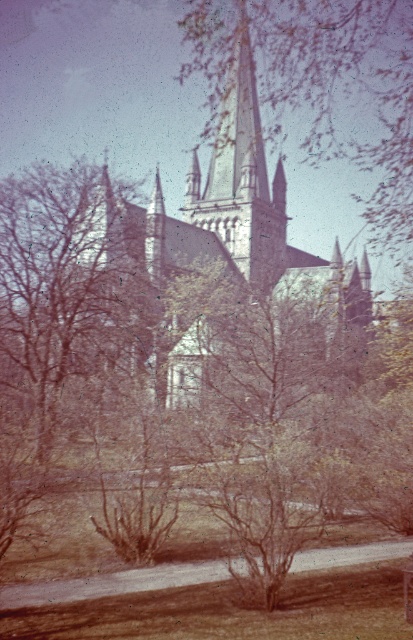
Question: Which object appears closest to the camera in this image?

Choices:
 (A) smooth gray steeple at center
 (B) smooth stone tower at center
 (C) gray stone church at center
 (D) brown leafy tree at left

Answer: (D)

Question: Is brown leafy tree at left positioned at the back of smooth gray steeple at center?

Choices:
 (A) yes
 (B) no

Answer: (B)

Question: Does brown leafy tree at left have a lesser width compared to smooth stone tower at center?

Choices:
 (A) yes
 (B) no

Answer: (B)

Question: Which object is the farthest from the smooth stone tower at center?

Choices:
 (A) gray stone church at center
 (B) brown leafy tree at left

Answer: (B)

Question: Which of the following is the farthest from the observer?

Choices:
 (A) (336, 8)
 (B) (241, 61)
 (C) (90, 243)
 (D) (220, 122)

Answer: (B)

Question: Where is smooth gray steeple at center located in relation to gray stone church at center in the image?

Choices:
 (A) below
 (B) above

Answer: (B)